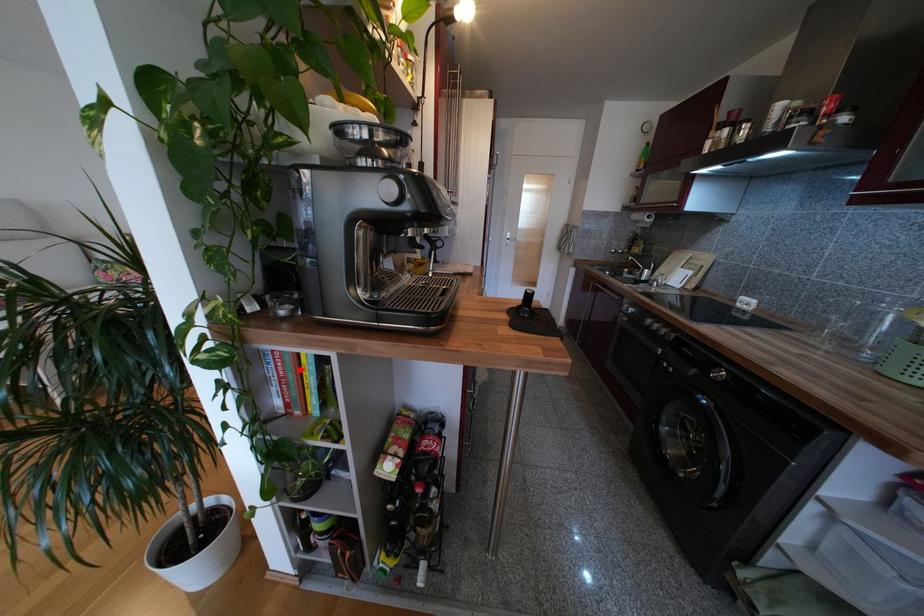
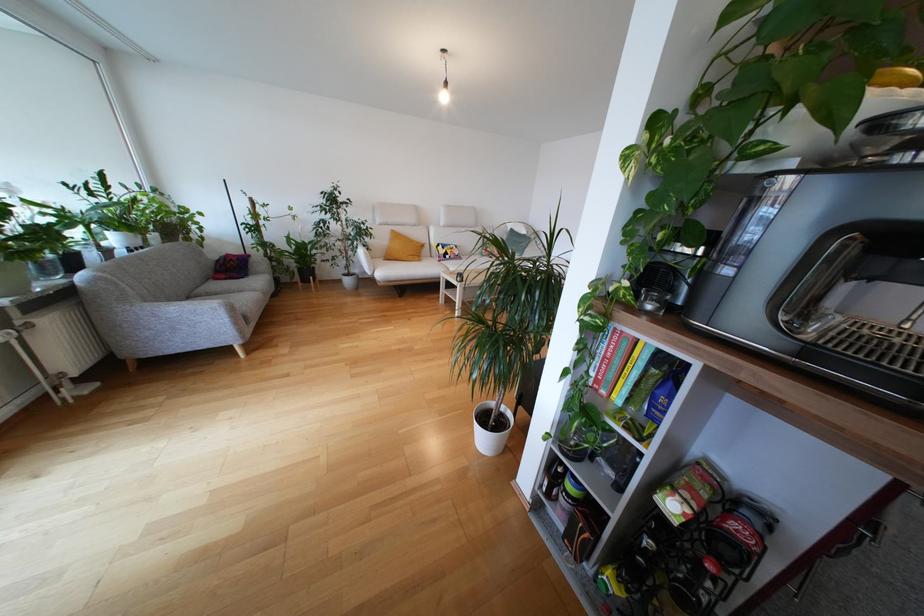
Question: I am providing you with two images of the same scene from different viewpoints. Given a red point in image1, look at the same physical point in image2. Is it:

Choices:
 (A) Closer to the viewpoint
 (B) Farther from the viewpoint

Answer: (A)